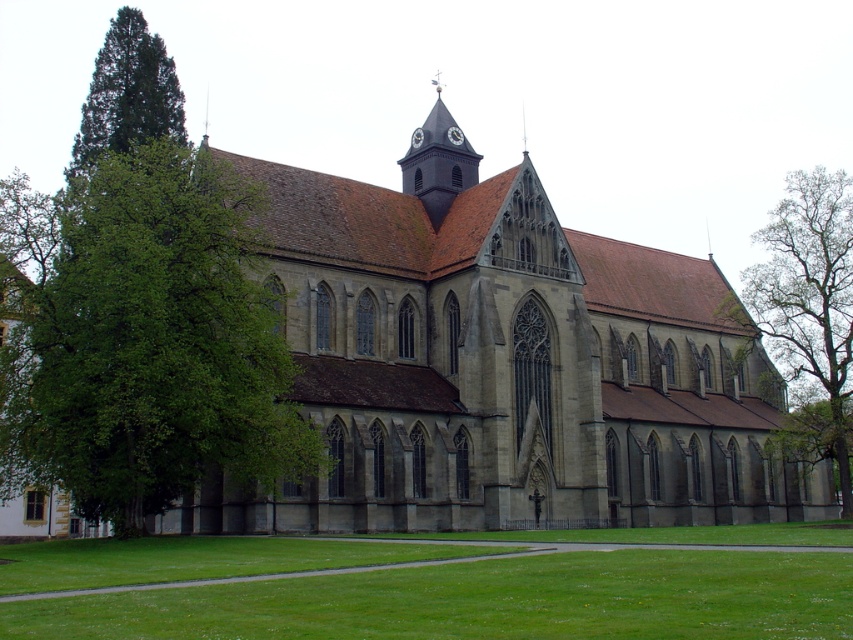
Question: Where is green coniferous tree at left located in relation to smooth brown clock tower at upper center in the image?

Choices:
 (A) right
 (B) left

Answer: (B)

Question: Based on their relative distances, which object is farther from the green leafy tree at right?

Choices:
 (A) gray stone church at center
 (B) smooth brown clock tower at upper center

Answer: (B)

Question: Does green leafy tree at left have a larger size compared to green coniferous tree at left?

Choices:
 (A) no
 (B) yes

Answer: (A)

Question: Can you confirm if green leafy tree at left is positioned below smooth brown clock tower at upper center?

Choices:
 (A) yes
 (B) no

Answer: (A)

Question: Estimate the real-world distances between objects in this image. Which object is closer to the green coniferous tree at left?

Choices:
 (A) gray stone church at center
 (B) green leafy tree at left
 (C) green leafy tree at right
 (D) smooth brown clock tower at upper center

Answer: (B)

Question: Which point is farther to the camera?

Choices:
 (A) (563, 232)
 (B) (426, 129)
 (C) (799, 260)
 (D) (212, 416)

Answer: (C)